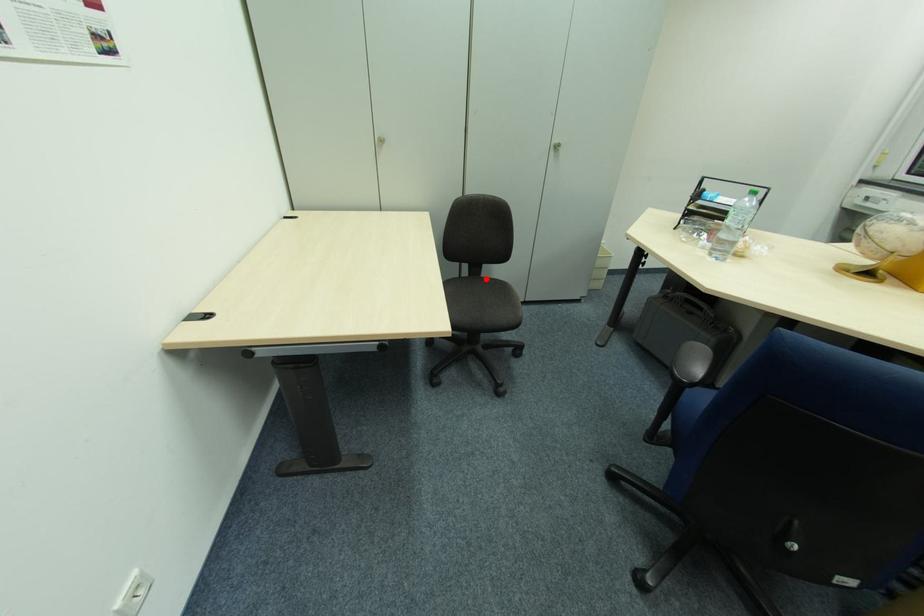
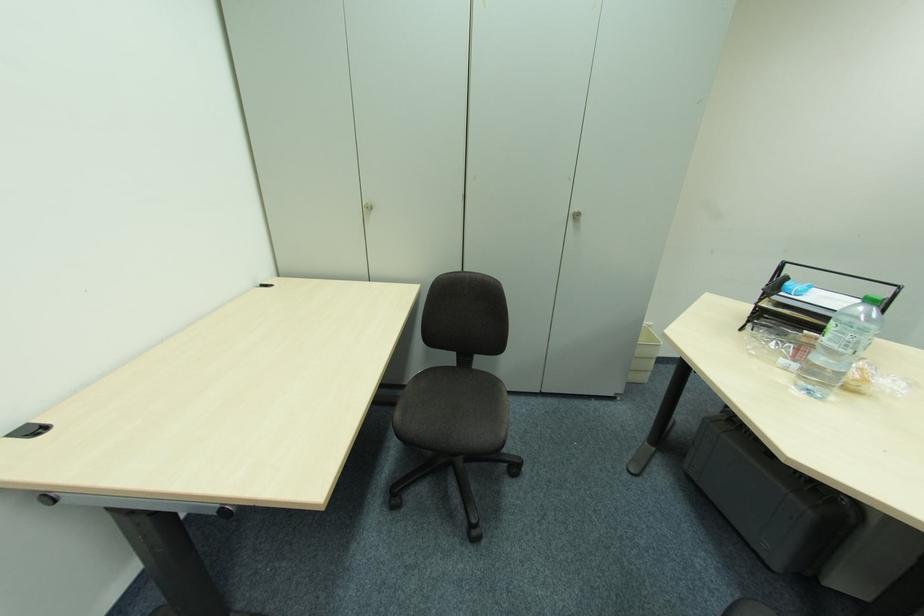
The point at the highlighted location is marked in the first image. Where is the corresponding point in the second image?

(477, 371)